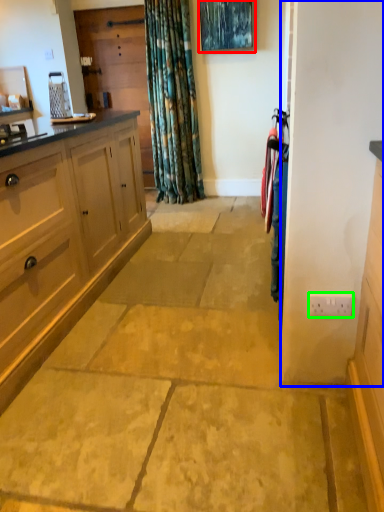
Question: Considering the real-world distances, which object is farthest from picture frame (highlighted by a red box)? screen door (highlighted by a blue box) or electric outlet (highlighted by a green box)?

Choices:
 (A) screen door
 (B) electric outlet

Answer: (B)